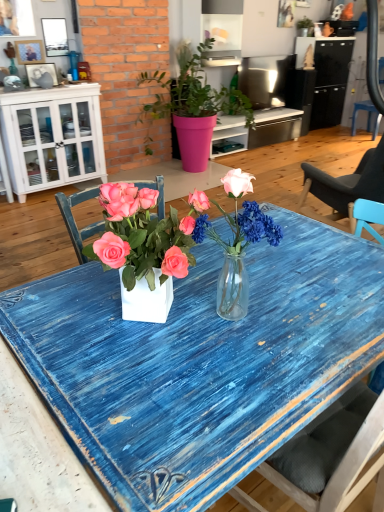
Question: Does translucent glass vase at center have a lesser width compared to white wood cabinet at left?

Choices:
 (A) yes
 (B) no

Answer: (A)

Question: From a real-world perspective, is translucent glass vase at center located higher than white wood cabinet at left?

Choices:
 (A) no
 (B) yes

Answer: (B)

Question: Considering the relative sizes of translucent glass vase at center and white wood cabinet at left in the image provided, is translucent glass vase at center bigger than white wood cabinet at left?

Choices:
 (A) yes
 (B) no

Answer: (B)

Question: Is translucent glass vase at center positioned far away from white wood cabinet at left?

Choices:
 (A) no
 (B) yes

Answer: (B)

Question: Is translucent glass vase at center taller than white wood cabinet at left?

Choices:
 (A) yes
 (B) no

Answer: (B)

Question: From a real-world perspective, is blue plastic chair at right positioned above or below wooden picture frame at upper left, placed as the second picture frame when sorted from bottom to top?

Choices:
 (A) below
 (B) above

Answer: (A)

Question: From their relative heights in the image, would you say blue plastic chair at right is taller or shorter than wooden picture frame at upper left, placed as the second picture frame when sorted from top to bottom?

Choices:
 (A) tall
 (B) short

Answer: (A)

Question: In the image, is blue plastic chair at right positioned in front of or behind wooden picture frame at upper left, placed as the second picture frame when sorted from top to bottom?

Choices:
 (A) front
 (B) behind

Answer: (B)

Question: Visually, is blue plastic chair at right positioned to the left or to the right of wooden picture frame at upper left, placed as the second picture frame when sorted from top to bottom?

Choices:
 (A) right
 (B) left

Answer: (A)

Question: In terms of height, does translucent glass vase at center look taller or shorter compared to blue plastic chair at right?

Choices:
 (A) tall
 (B) short

Answer: (B)

Question: Considering the positions of translucent glass vase at center and blue plastic chair at right in the image, is translucent glass vase at center wider or thinner than blue plastic chair at right?

Choices:
 (A) thin
 (B) wide

Answer: (A)

Question: From a real-world perspective, is translucent glass vase at center above or below blue plastic chair at right?

Choices:
 (A) below
 (B) above

Answer: (B)

Question: Is translucent glass vase at center in front of or behind blue plastic chair at right in the image?

Choices:
 (A) front
 (B) behind

Answer: (A)

Question: From a real-world perspective, is matte black picture frame at upper left, acting as the first picture frame starting from the bottom, above or below translucent glass vase at center?

Choices:
 (A) below
 (B) above

Answer: (B)

Question: Looking at the image, does matte black picture frame at upper left, acting as the first picture frame starting from the bottom, seem bigger or smaller compared to translucent glass vase at center?

Choices:
 (A) big
 (B) small

Answer: (B)